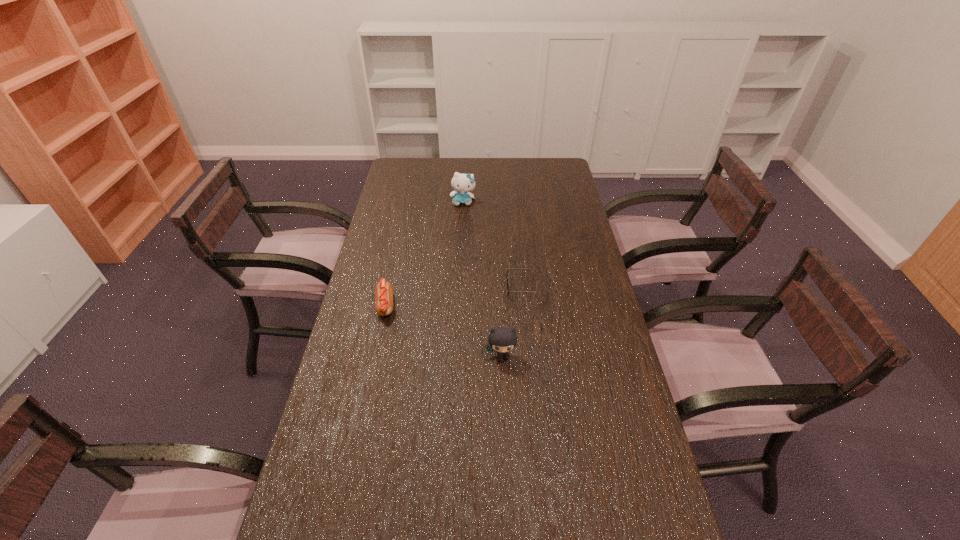
Image resolution: width=960 pixels, height=540 pixels. Identify the location of empty space that is in between the leftmost object and the right kitten. pyautogui.click(x=444, y=331).

In order to click on unoccupied position between the sausage and the nearest object in this screenshot , I will do `click(444, 331)`.

I want to click on free spot between the taller kitten and the second shortest object, so click(x=424, y=254).

I want to click on free space between the sausage and the nearest object, so click(x=444, y=331).

At what (x,y) coordinates should I click in order to perform the action: click on empty space that is in between the spectacles and the leftmost object. Please return your answer as a coordinate pair (x, y). The image size is (960, 540). Looking at the image, I should click on (455, 296).

This screenshot has height=540, width=960. I want to click on vacant region between the leftmost object and the shortest object, so click(455, 296).

The width and height of the screenshot is (960, 540). Identify the location of unoccupied position between the tallest object and the spectacles. (494, 245).

The width and height of the screenshot is (960, 540). In order to click on free space between the leftmost object and the left kitten in this screenshot , I will do `click(424, 254)`.

Locate which object is the second closest to the right kitten. Please provide its 2D coordinates. Your answer should be formatted as a tuple, i.e. [(x, y)], where the tuple contains the x and y coordinates of a point satisfying the conditions above.

[(383, 291)]

Locate which object is the second closest to the sausage. Please provide its 2D coordinates. Your answer should be formatted as a tuple, i.e. [(x, y)], where the tuple contains the x and y coordinates of a point satisfying the conditions above.

[(507, 281)]